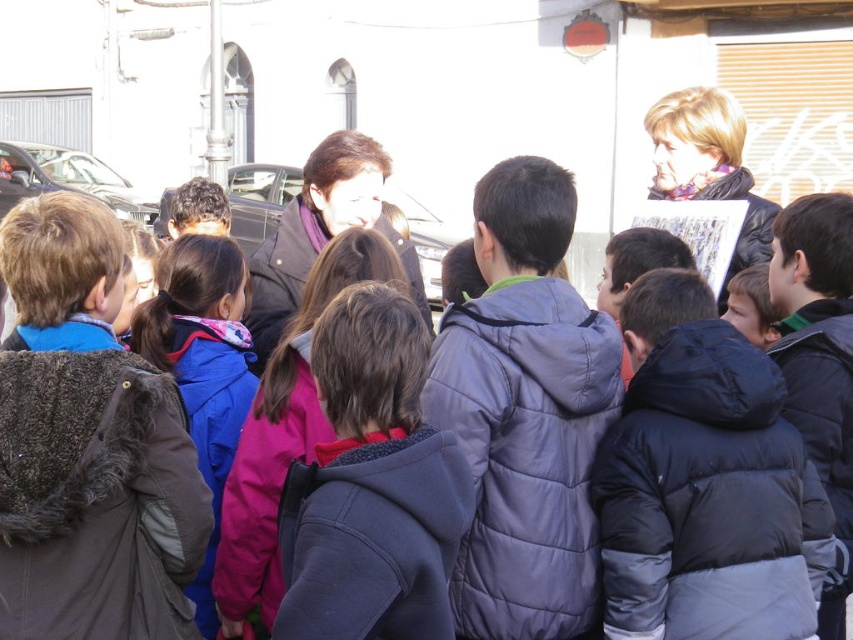
You are a photographer trying to capture a clear shot of the dark blue puffy jacket at center and the pink fleece jacket at center. Since the camera can only focus on one subject at a time, which jacket should you choose to ensure the photo is sharp if you want to prioritize the larger one?

The dark blue puffy jacket at center is bigger than the pink fleece jacket at center, so you should focus on the dark blue puffy jacket at center to ensure the photo is sharp since it is the larger one.

You are a photographer trying to capture a group photo of the children in the scene. Since you want to ensure that all children are visible, you need to know which child is wider so you can position them appropriately. Which child has a wider jacket between the black puffy jacket at center and the dark blue puffy jacket at center?

The black puffy jacket at center is wider than the dark blue puffy jacket at center according to the description, so positioning the child in the black puffy jacket at center in a way that accommodates their wider jacket would help ensure all children are visible in the group photo.